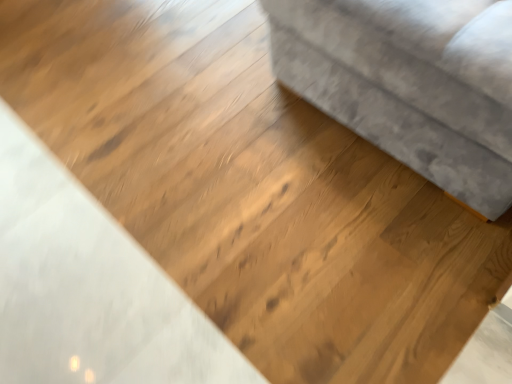
What do you see at coordinates (411, 83) in the screenshot? I see `velvet grey sofa at right` at bounding box center [411, 83].

Where is `velvet grey sofa at right`? This screenshot has height=384, width=512. velvet grey sofa at right is located at coordinates (411, 83).

Locate an element on the screen. velvet grey sofa at right is located at coordinates (411, 83).